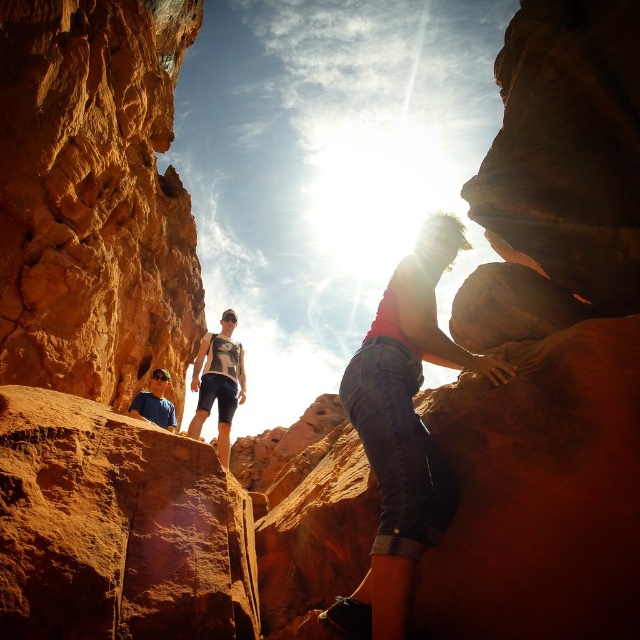
Can you confirm if denim shorts at center is shorter than matte blue shirt at lower left?

No.

Who is lower down, denim shorts at center or matte blue shirt at lower left?

matte blue shirt at lower left is below.

Describe the element at coordinates (403, 429) in the screenshot. This screenshot has height=640, width=640. I see `denim shorts at center` at that location.

Locate an element on the screen. denim shorts at center is located at coordinates (403, 429).

Between rustic sandstone rock at left and matte blue shirt at lower left, which one is positioned lower?

matte blue shirt at lower left is lower down.

Is point (186, 291) farther from viewer compared to point (172, 408)?

Yes, it is.

Which is behind, point (81, 120) or point (152, 406)?

The point (152, 406) is behind.

The width and height of the screenshot is (640, 640). I want to click on rustic sandstone rock at left, so 93,196.

Between rustic sandstone rock at left and printed cotton t-shirt at center, which one is positioned higher?

rustic sandstone rock at left is above.

Is rustic sandstone rock at left smaller than printed cotton t-shirt at center?

No.

The width and height of the screenshot is (640, 640). What do you see at coordinates (93, 196) in the screenshot? I see `rustic sandstone rock at left` at bounding box center [93, 196].

The image size is (640, 640). Identify the location of rustic sandstone rock at left. (93, 196).